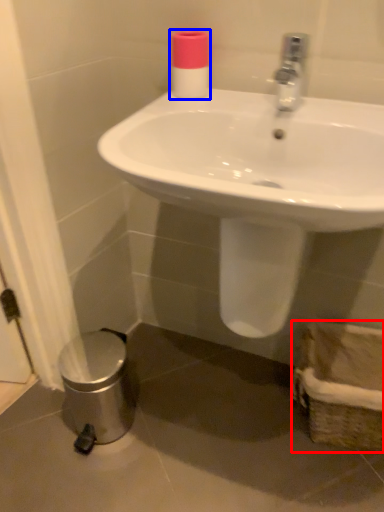
Question: Which of the following is the farthest to the observer, basket (highlighted by a red box) or toiletry (highlighted by a blue box)?

Choices:
 (A) basket
 (B) toiletry

Answer: (A)